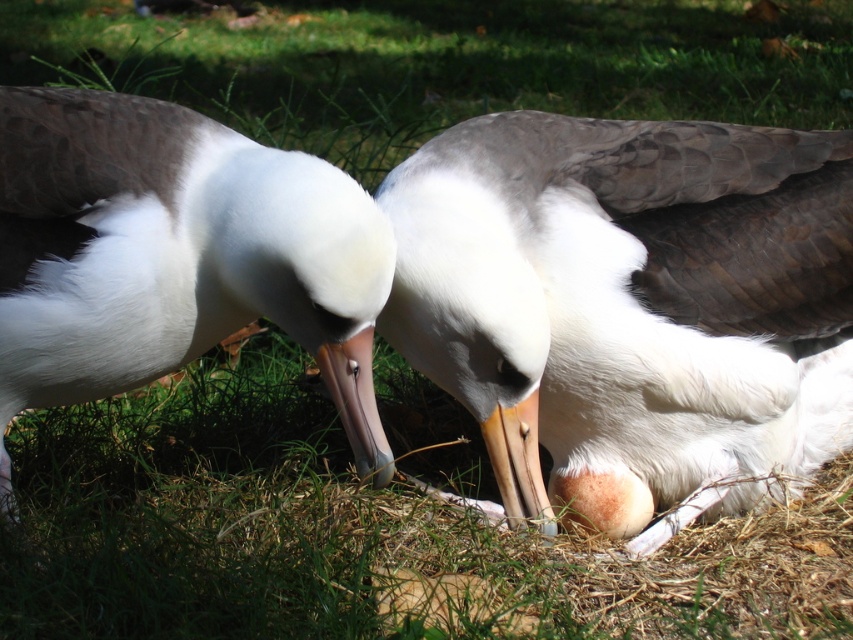
Question: Which of the following is the farthest from the observer?

Choices:
 (A) white fluffy feathers at center
 (B) white matte mollymawk at center

Answer: (A)

Question: Which of the following is the farthest from the observer?

Choices:
 (A) (12, 292)
 (B) (425, 221)

Answer: (B)

Question: Is white fluffy feathers at center positioned in front of white matte mollymawk at center?

Choices:
 (A) no
 (B) yes

Answer: (A)

Question: Does white fluffy feathers at center appear on the right side of white matte mollymawk at center?

Choices:
 (A) no
 (B) yes

Answer: (B)

Question: Observing the image, what is the correct spatial positioning of white fluffy feathers at center in reference to white matte mollymawk at center?

Choices:
 (A) right
 (B) left

Answer: (A)